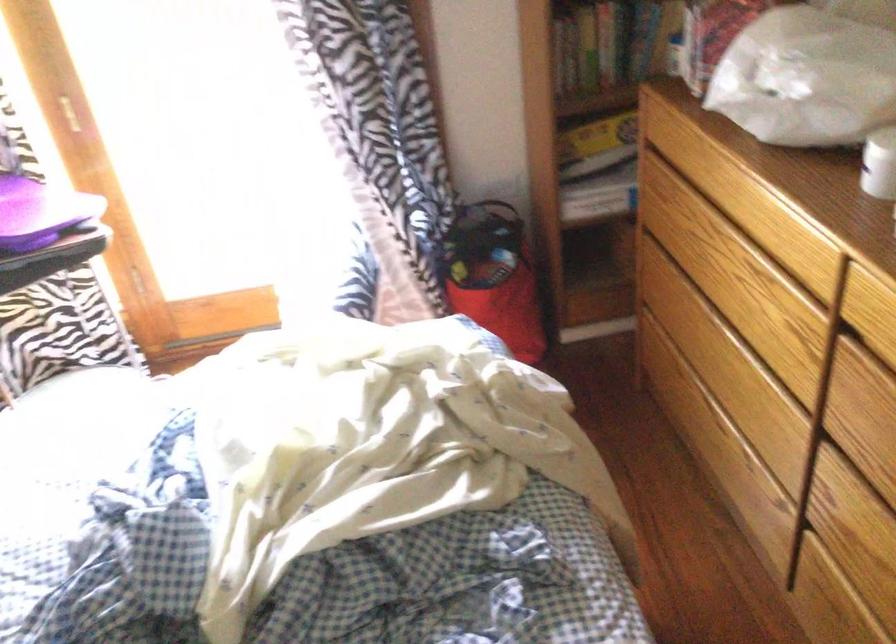
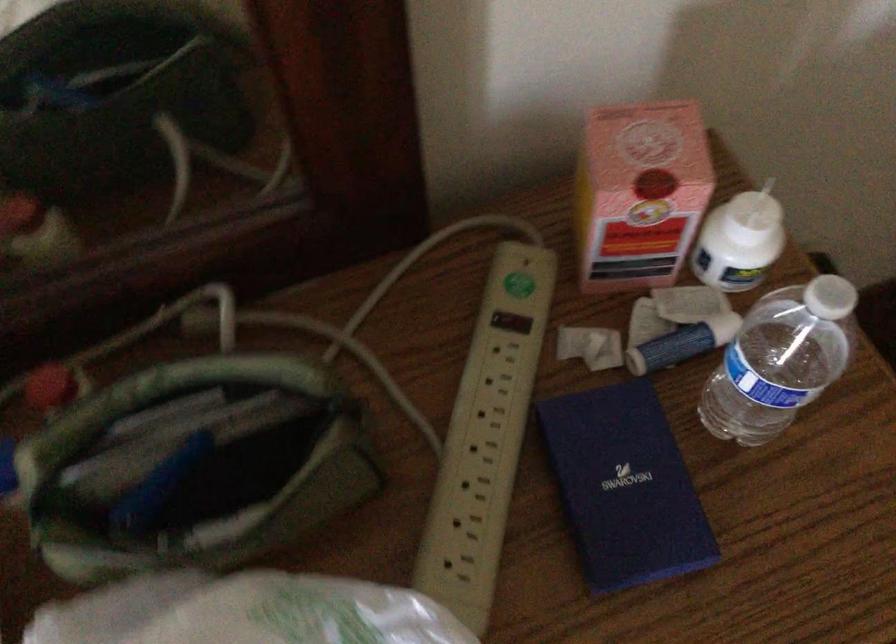
The images are taken continuously from a first-person perspective. In which direction is your viewpoint rotating?

The rotation direction of the camera is right-down.